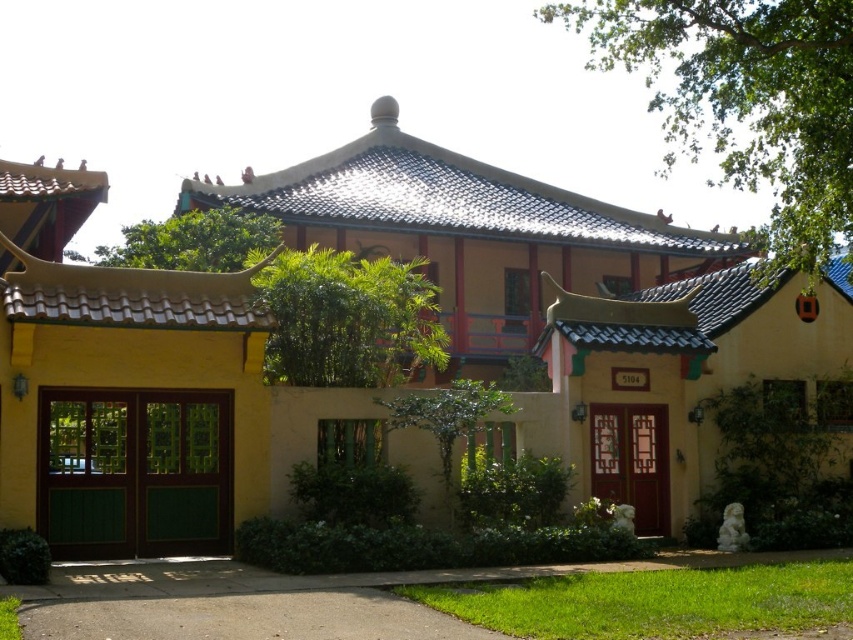
Question: Is green leafy tree at upper right to the left of green leafy tree at upper center from the viewer's perspective?

Choices:
 (A) no
 (B) yes

Answer: (A)

Question: Which point is farther from the camera taking this photo?

Choices:
 (A) (254, 227)
 (B) (827, 44)
 (C) (451, 392)

Answer: (A)

Question: Which object is closer to the camera taking this photo?

Choices:
 (A) green leafy tree at upper center
 (B) green leafy tree at center
 (C) green leafy tree at upper right

Answer: (C)

Question: Does green leafy tree at upper center have a lesser width compared to green leafy tree at center?

Choices:
 (A) no
 (B) yes

Answer: (A)

Question: Estimate the real-world distances between objects in this image. Which object is closer to the green leafy tree at center?

Choices:
 (A) green leafy tree at upper center
 (B) green leafy tree at upper right

Answer: (A)

Question: Does green leafy tree at upper right come behind green leafy tree at center?

Choices:
 (A) yes
 (B) no

Answer: (B)